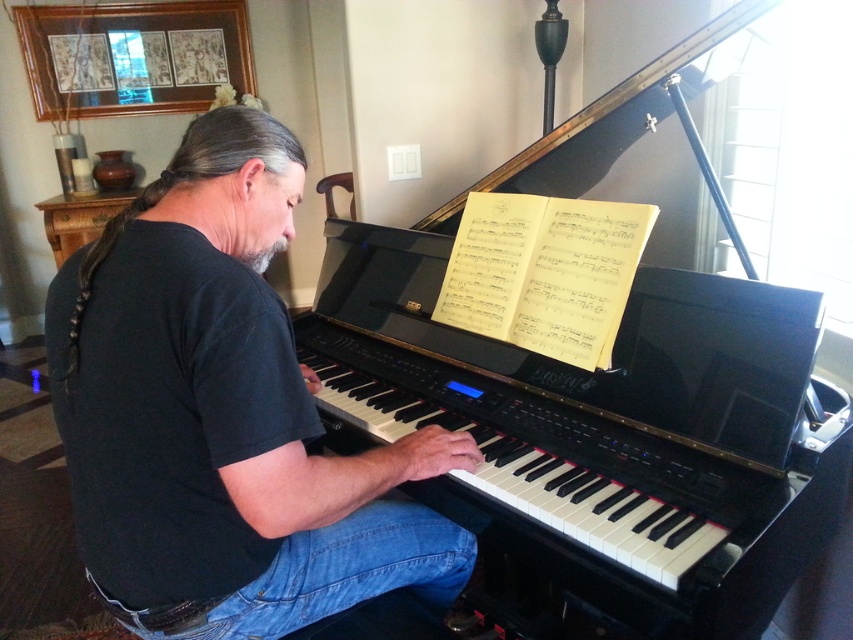
You are standing in the room where the man is playing the piano. You want to place a small plant on the floor exactly 1.5 meters away from the point marked at coordinates point (521, 184). Is this possible within the room?

The distance between point (521, 184) and the camera is 1.75 meters. Since you want to place the plant 1.5 meters away from the point, it is possible as 1.5 meters is less than the available distance from the point to the camera. However, the room layout must be considered to ensure space exists in the desired direction from the point.

Looking at this image, you are a musician who needs to place a new music stand for the black glossy harpsichord at center. Given the coordinates from the scene description, where should the music stand be positioned relative to the harpsichord?

The black glossy harpsichord at center is located at point coordinates, so the music stand should be placed above the keyboard of the harpsichord to ensure the musician can read the sheet music comfortably while playing.

You are a photographer trying to capture a clear shot of the black glossy harpsichord at center and the black cotton shirt at center. Which object is closer to the camera based on their positions?

The black glossy harpsichord at center is positioned over the black cotton shirt at center, meaning it is closer to the camera.